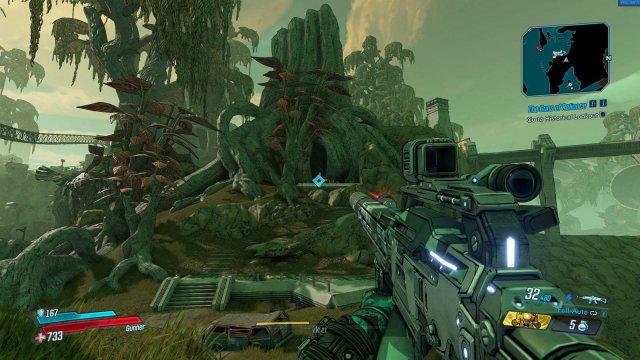
Find the location of a particular element. The width and height of the screenshot is (640, 360). stairs is located at coordinates (196, 287).